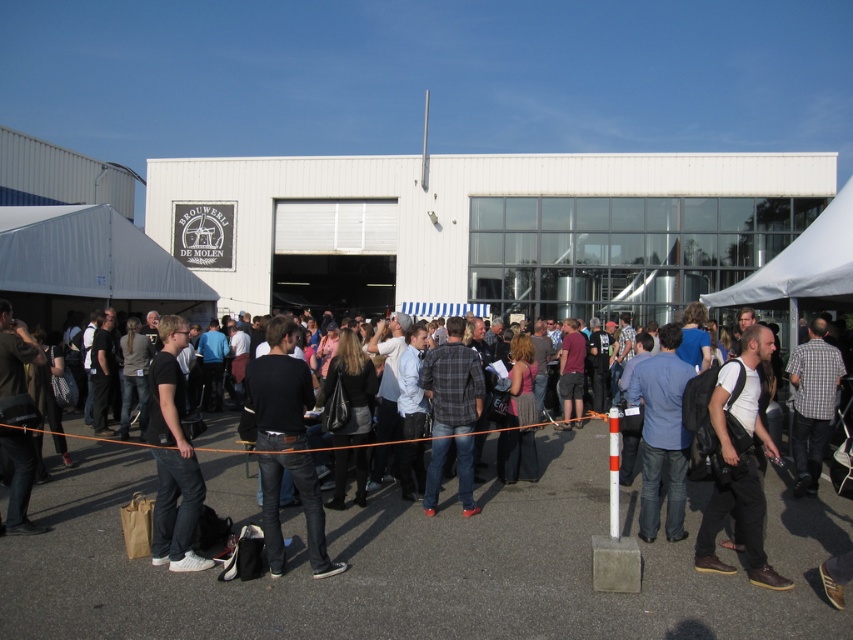
You are a photographer at the event and need to capture a photo of both the dark blue jeans at center and the blue denim jeans at center in the same frame. Your camera has a minimum focus distance of 1.5 meters. Can you take the photo without moving either subject?

The distance between the dark blue jeans at center and blue denim jeans at center is 2.08 meters, which is greater than the camera minimum focus distance of 1.5 meters. Therefore, the photographer can capture both subjects in the same frame without moving them.

You are at the Brouwerij De Molen event and want to find someone wearing a black matte shirt at center. Where relative to the dark gray jeans at lower left should you look?

The black matte shirt at center is positioned on the right side of the dark gray jeans at lower left, so you should look to the right of the dark gray jeans at lower left to find the person wearing the black matte shirt at center.